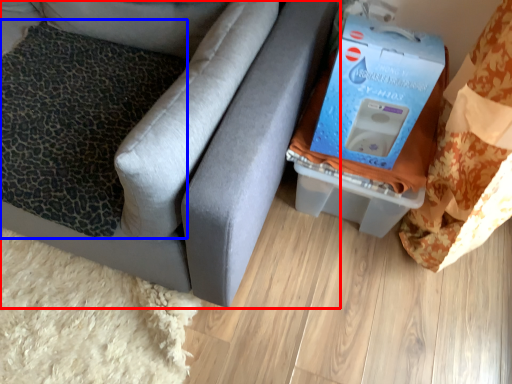
Question: Which object appears closest to the camera in this image, furniture (highlighted by a red box) or pillow (highlighted by a blue box)?

Choices:
 (A) furniture
 (B) pillow

Answer: (A)